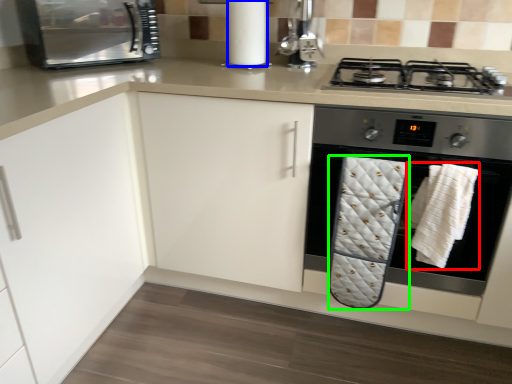
Question: Which object is positioned closest to bath towel (highlighted by a red box)? Select from paper towel (highlighted by a blue box) and bath towel (highlighted by a green box).

Choices:
 (A) paper towel
 (B) bath towel

Answer: (B)